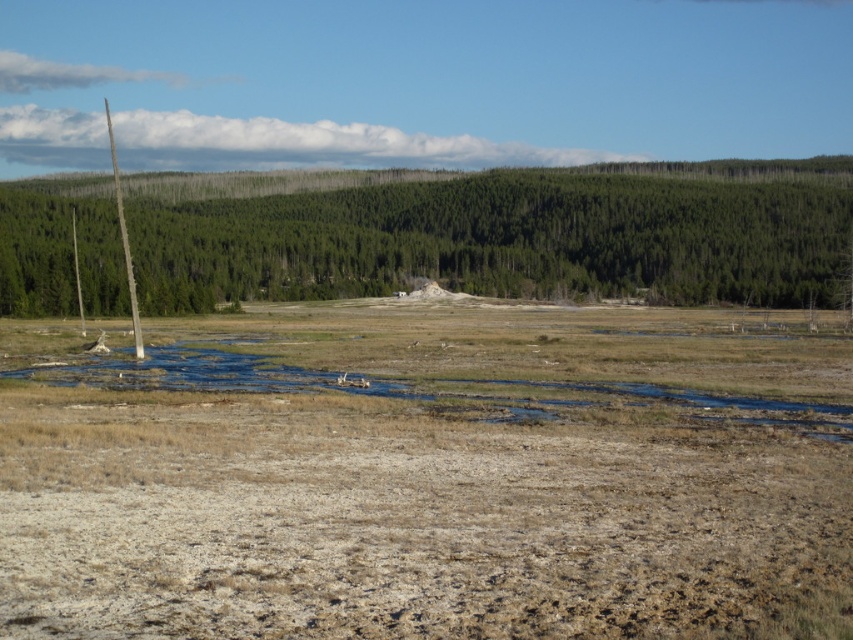
Question: Does brown dry grass at center lie in front of brown wood pole at left?

Choices:
 (A) no
 (B) yes

Answer: (B)

Question: Which object is closer to the camera taking this photo?

Choices:
 (A) brown dry grass at center
 (B) brown wood pole at left

Answer: (A)

Question: Can you confirm if brown dry grass at center is positioned below brown wood pole at left?

Choices:
 (A) yes
 (B) no

Answer: (A)

Question: Which point is farther from the camera taking this photo?

Choices:
 (A) click(207, 230)
 (B) click(587, 308)

Answer: (A)

Question: Does brown dry grass at center come in front of brown wood pole at left?

Choices:
 (A) yes
 (B) no

Answer: (A)